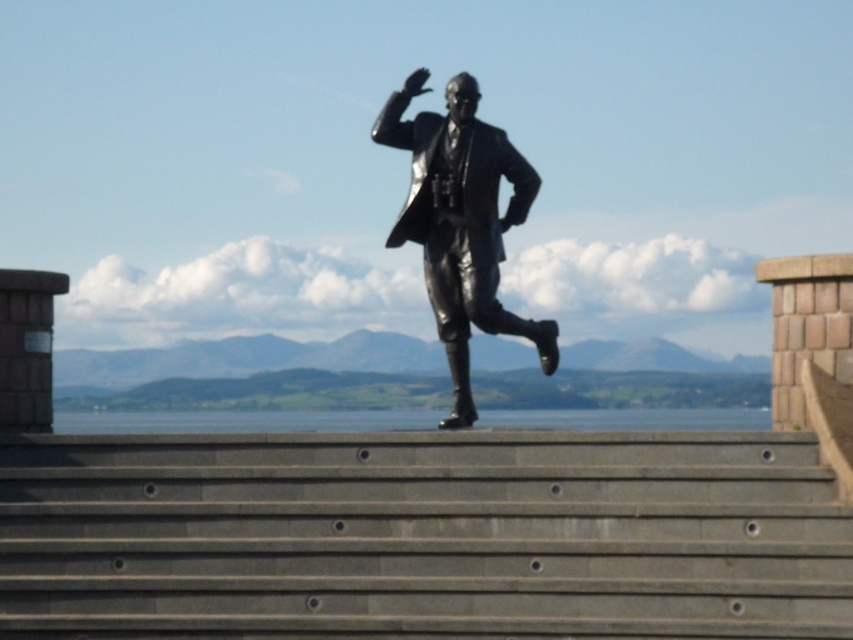
Question: Does shiny bronze statue at center have a smaller size compared to clear blue water at center?

Choices:
 (A) yes
 (B) no

Answer: (A)

Question: Estimate the real-world distances between objects in this image. Which object is farther from the gray concrete stairs at center?

Choices:
 (A) clear blue water at center
 (B) shiny bronze statue at center

Answer: (A)

Question: Which object is positioned farthest from the shiny bronze statue at center?

Choices:
 (A) gray concrete stairs at center
 (B) clear blue water at center

Answer: (B)

Question: Does gray concrete stairs at center have a lesser width compared to shiny bronze statue at center?

Choices:
 (A) yes
 (B) no

Answer: (B)

Question: Does gray concrete stairs at center appear over shiny bronze statue at center?

Choices:
 (A) yes
 (B) no

Answer: (B)

Question: Which of the following is the farthest from the observer?

Choices:
 (A) clear blue water at center
 (B) gray concrete stairs at center

Answer: (A)